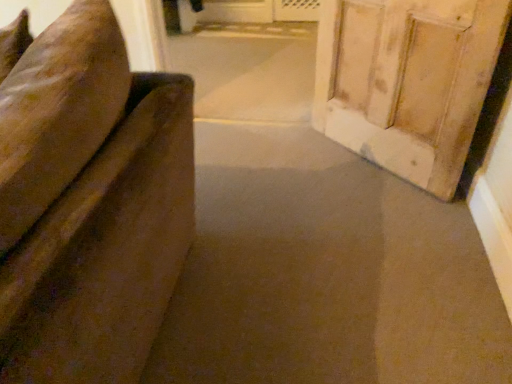
Question: Does point (226, 82) appear closer or farther from the camera than point (407, 92)?

Choices:
 (A) closer
 (B) farther

Answer: (B)

Question: Considering the relative positions of velvet-like brown couch at left and wooden door at right in the image provided, is velvet-like brown couch at left to the left or to the right of wooden door at right?

Choices:
 (A) left
 (B) right

Answer: (A)

Question: Looking at the image, does velvet-like brown couch at left seem bigger or smaller compared to wooden door at right?

Choices:
 (A) small
 (B) big

Answer: (B)

Question: In terms of size, does wooden door at right appear bigger or smaller than velvet-like brown couch at left?

Choices:
 (A) small
 (B) big

Answer: (A)

Question: Considering the positions of wooden door at right and velvet-like brown couch at left in the image, is wooden door at right wider or thinner than velvet-like brown couch at left?

Choices:
 (A) thin
 (B) wide

Answer: (A)

Question: Is wooden door at right to the left or to the right of velvet-like brown couch at left in the image?

Choices:
 (A) right
 (B) left

Answer: (A)

Question: Relative to velvet-like brown couch at left, is wooden door at right in front or behind?

Choices:
 (A) behind
 (B) front

Answer: (B)